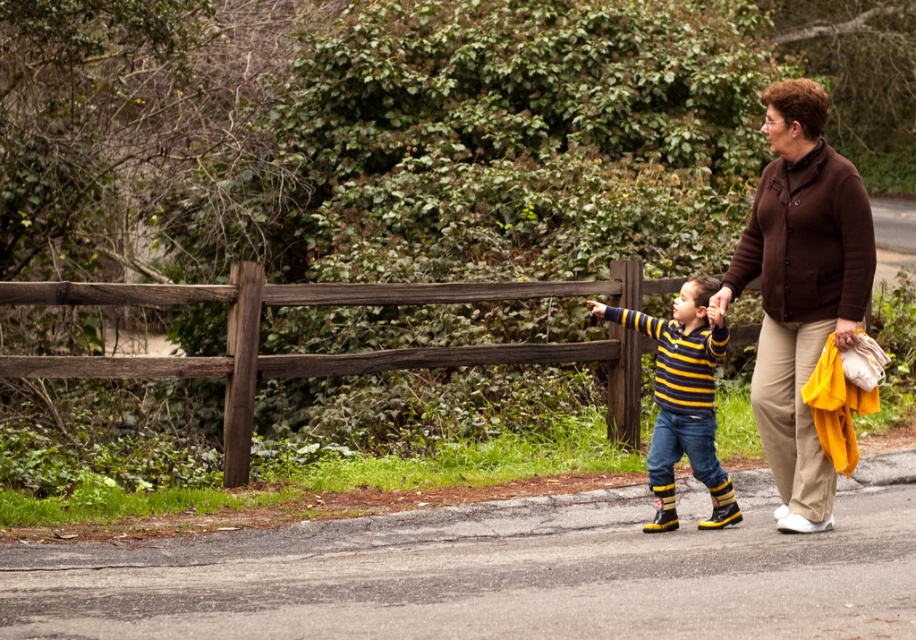
Between brown cardigan at right and striped knit sweater at center, which one appears on the left side from the viewer's perspective?

From the viewer's perspective, striped knit sweater at center appears more on the left side.

Is the position of brown cardigan at right less distant than that of striped knit sweater at center?

Yes, it is in front of striped knit sweater at center.

The height and width of the screenshot is (640, 916). What do you see at coordinates (800, 289) in the screenshot?
I see `brown cardigan at right` at bounding box center [800, 289].

Identify the location of brown cardigan at right. The height and width of the screenshot is (640, 916). (800, 289).

Between brown wooden fence at left and striped knit sweater at center, which one appears on the right side from the viewer's perspective?

striped knit sweater at center

Can you confirm if brown wooden fence at left is smaller than striped knit sweater at center?

No, brown wooden fence at left is not smaller than striped knit sweater at center.

Locate an element on the screen. The width and height of the screenshot is (916, 640). brown wooden fence at left is located at coordinates (340, 353).

Is brown cardigan at right smaller than brown wooden fence at left?

Correct, brown cardigan at right occupies less space than brown wooden fence at left.

Between brown cardigan at right and brown wooden fence at left, which one is positioned higher?

Positioned higher is brown cardigan at right.

You are a GUI agent. You are given a task and a screenshot of the screen. Output one action in this format:
    pyautogui.click(x=<x>, y=<y>)
    Task: Click on the brown cardigan at right
    The height and width of the screenshot is (640, 916).
    Given the screenshot: What is the action you would take?
    pyautogui.click(x=800, y=289)